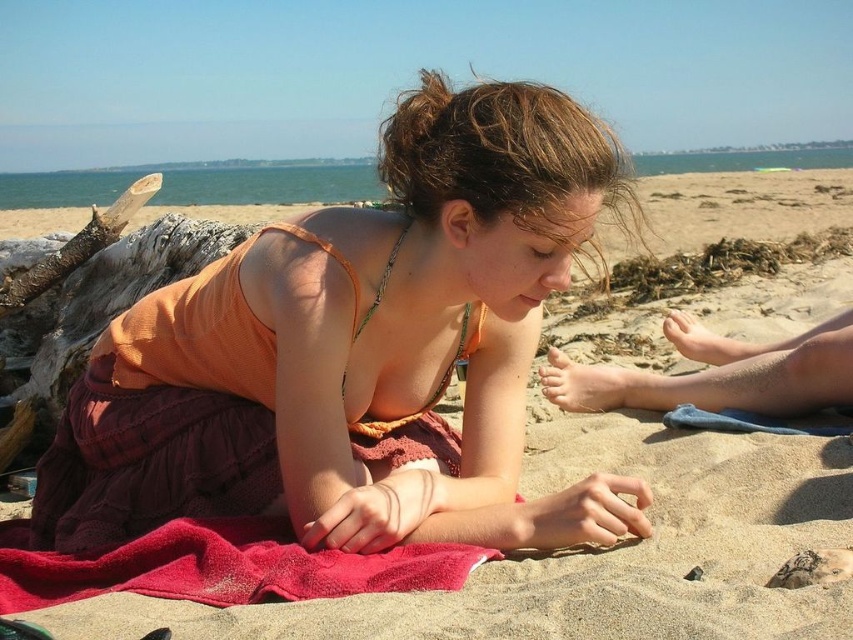
Question: Does orange fabric dress at center appear under red terry cloth at lower center?

Choices:
 (A) yes
 (B) no

Answer: (B)

Question: Can you confirm if orange fabric dress at center is smaller than red terry cloth at lower center?

Choices:
 (A) yes
 (B) no

Answer: (B)

Question: Which point is farther to the camera?

Choices:
 (A) orange fabric dress at center
 (B) red terry cloth at lower center

Answer: (A)

Question: Is the position of orange fabric dress at center less distant than that of red terry cloth at lower center?

Choices:
 (A) no
 (B) yes

Answer: (A)